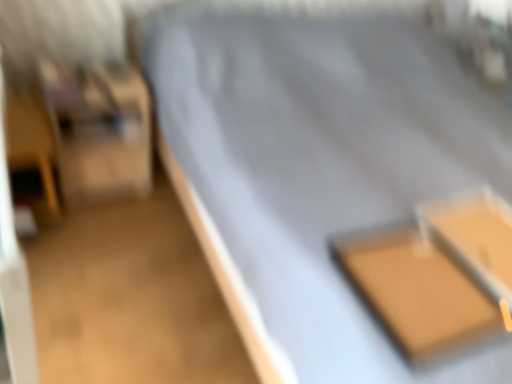
This screenshot has height=384, width=512. What do you see at coordinates (437, 274) in the screenshot?
I see `matte brown tray at lower right` at bounding box center [437, 274].

You are a GUI agent. You are given a task and a screenshot of the screen. Output one action in this format:
    pyautogui.click(x=<x>, y=<y>)
    Task: Click on the matte brown tray at lower right
    Image resolution: width=512 pixels, height=384 pixels.
    Given the screenshot: What is the action you would take?
    pyautogui.click(x=437, y=274)

Find the location of a particular element. This screenshot has width=512, height=384. matte brown tray at lower right is located at coordinates (437, 274).